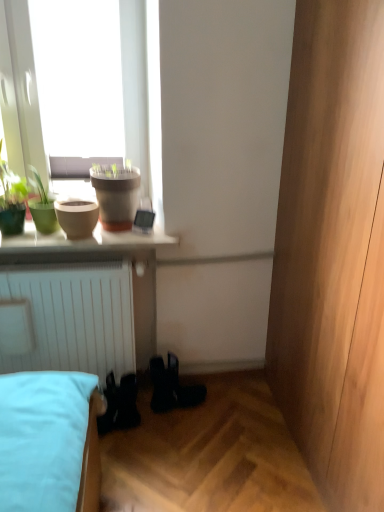
Question: Should I look upward or downward to see green matte pot at upper left, the second houseplant in the left-to-right sequence?

Choices:
 (A) up
 (B) down

Answer: (A)

Question: Does green matte pot at upper left, marked as the first houseplant in a right-to-left arrangement, come in front of matte clay pot at upper left, which is counted as the 2th flowerpot, starting from the left?

Choices:
 (A) yes
 (B) no

Answer: (A)

Question: Does green matte pot at upper left, the second houseplant in the left-to-right sequence, have a lesser width compared to matte clay pot at upper left, which is counted as the 2th flowerpot, starting from the left?

Choices:
 (A) no
 (B) yes

Answer: (B)

Question: Are green matte pot at upper left, the second houseplant in the left-to-right sequence, and matte clay pot at upper left, arranged as the 1th flowerpot when viewed from the right, located far from each other?

Choices:
 (A) no
 (B) yes

Answer: (A)

Question: Is matte clay pot at upper left, arranged as the 1th flowerpot when viewed from the right, surrounded by green matte pot at upper left, the second houseplant in the left-to-right sequence?

Choices:
 (A) yes
 (B) no

Answer: (B)

Question: Is green matte pot at upper left, marked as the first houseplant in a right-to-left arrangement, oriented towards matte clay pot at upper left, which is counted as the 2th flowerpot, starting from the left?

Choices:
 (A) yes
 (B) no

Answer: (B)

Question: Is green matte pot at upper left, marked as the first houseplant in a right-to-left arrangement, looking in the opposite direction of matte clay pot at upper left, which is counted as the 2th flowerpot, starting from the left?

Choices:
 (A) no
 (B) yes

Answer: (A)

Question: Is matte beige flowerpot at left, the 1th flowerpot viewed from the left, to the left of green matte plant at upper left, the 1th houseplant in the left-to-right sequence, from the viewer's perspective?

Choices:
 (A) yes
 (B) no

Answer: (B)

Question: Considering the relative sizes of matte beige flowerpot at left, the 1th flowerpot viewed from the left, and green matte plant at upper left, the 1th houseplant in the left-to-right sequence, in the image provided, is matte beige flowerpot at left, the 1th flowerpot viewed from the left, wider than green matte plant at upper left, the 1th houseplant in the left-to-right sequence,?

Choices:
 (A) yes
 (B) no

Answer: (B)

Question: Is matte beige flowerpot at left, the 1th flowerpot viewed from the left, positioned behind green matte plant at upper left, the second houseplant when ordered from right to left?

Choices:
 (A) no
 (B) yes

Answer: (B)

Question: Considering the relative sizes of matte beige flowerpot at left, the second flowerpot viewed from the right, and green matte plant at upper left, the 1th houseplant in the left-to-right sequence, in the image provided, is matte beige flowerpot at left, the second flowerpot viewed from the right, bigger than green matte plant at upper left, the 1th houseplant in the left-to-right sequence,?

Choices:
 (A) no
 (B) yes

Answer: (A)

Question: Is matte beige flowerpot at left, the second flowerpot viewed from the right, smaller than green matte plant at upper left, the 1th houseplant in the left-to-right sequence?

Choices:
 (A) no
 (B) yes

Answer: (B)

Question: From the image's perspective, would you say matte beige flowerpot at left, the second flowerpot viewed from the right, is shown under green matte plant at upper left, the second houseplant when ordered from right to left?

Choices:
 (A) no
 (B) yes

Answer: (B)

Question: Does green matte pot at upper left, the second houseplant in the left-to-right sequence, come in front of green matte plant at upper left, the 1th houseplant in the left-to-right sequence?

Choices:
 (A) yes
 (B) no

Answer: (B)